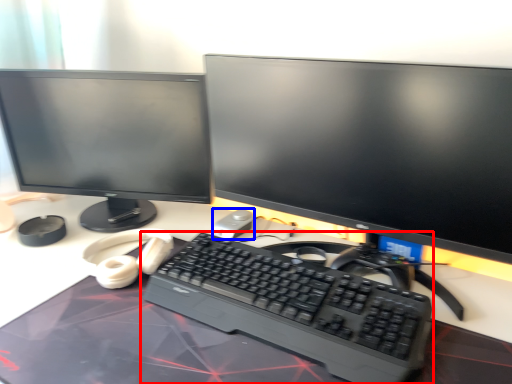
Question: Which point is further to the camera, computer keyboard (highlighted by a red box) or mouse (highlighted by a blue box)?

Choices:
 (A) computer keyboard
 (B) mouse

Answer: (B)